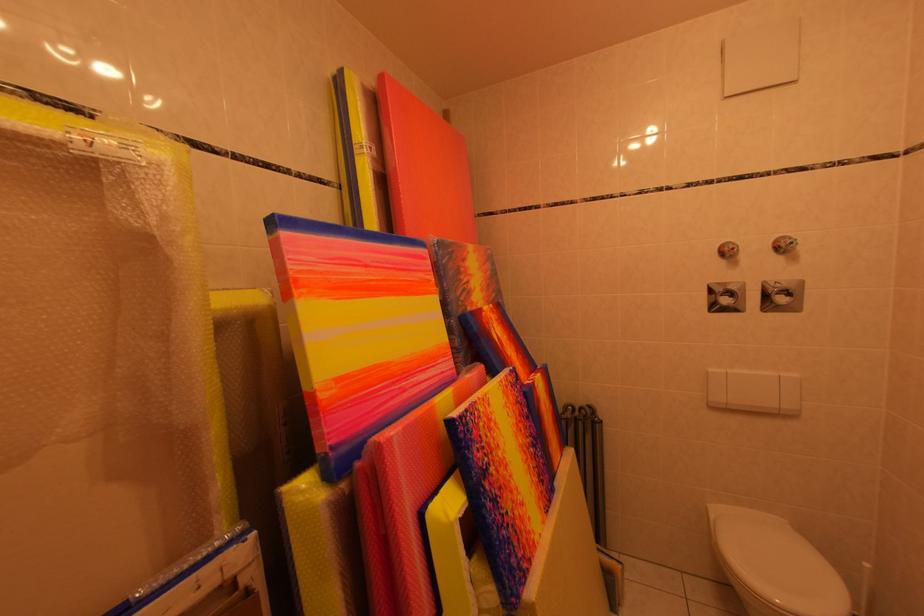
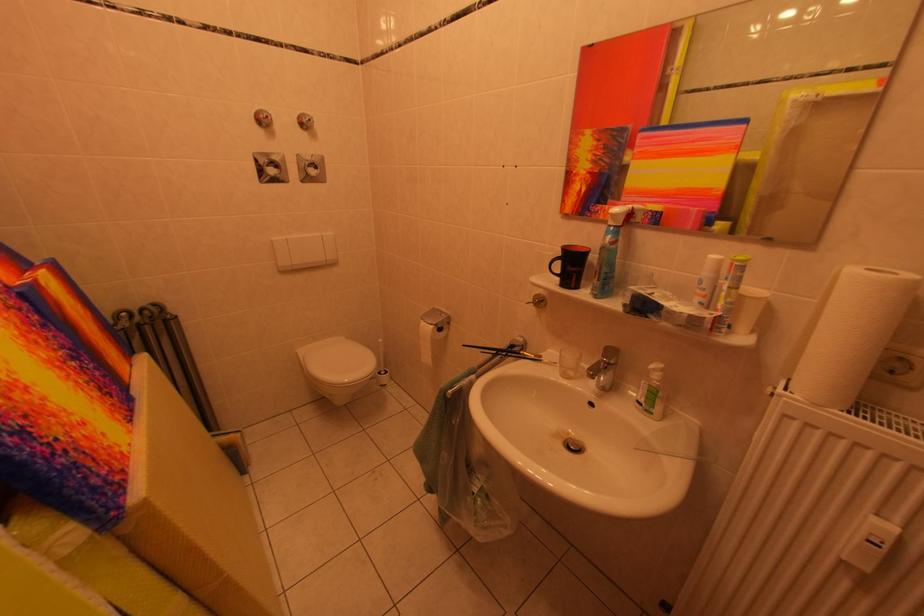
How did the camera likely rotate?

The camera rotated toward right-down.